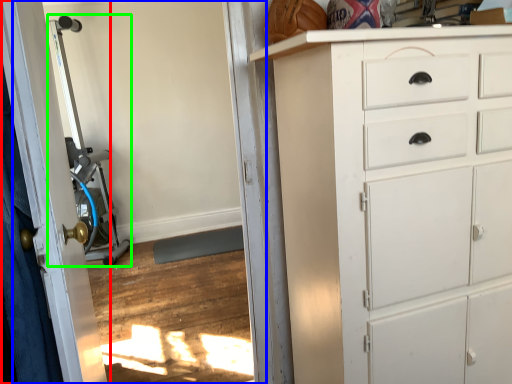
Question: Which object is positioned closest to door (highlighted by a red box)? Select from screen door (highlighted by a blue box) and sport equipment (highlighted by a green box).

Choices:
 (A) screen door
 (B) sport equipment

Answer: (A)